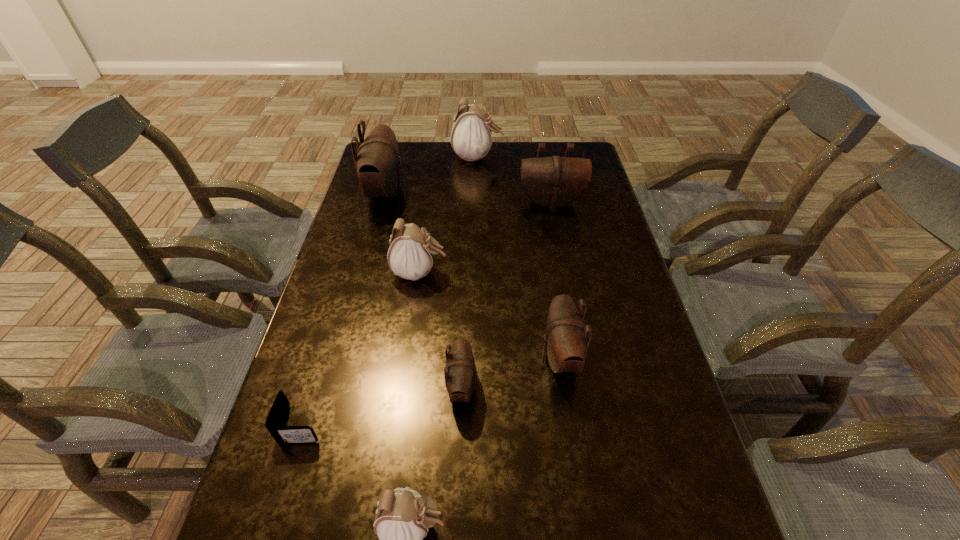
Where is `the biggest brown pouch`? This screenshot has height=540, width=960. the biggest brown pouch is located at coordinates (377, 161).

Identify the location of the leftmost pouch. The height and width of the screenshot is (540, 960). (377, 161).

Where is `the farthest white pouch`? the farthest white pouch is located at coordinates (471, 137).

This screenshot has width=960, height=540. Identify the location of the biggest white pouch. (471, 137).

Find the location of a particular element. the third smallest brown pouch is located at coordinates (552, 182).

Image resolution: width=960 pixels, height=540 pixels. Identify the location of the second smallest white pouch. (410, 256).

This screenshot has height=540, width=960. I want to click on the fourth farthest pouch, so click(410, 256).

Where is `the third biggest brown pouch`? The width and height of the screenshot is (960, 540). the third biggest brown pouch is located at coordinates (566, 341).

Find the location of a particular element. The width and height of the screenshot is (960, 540). the second brown pouch from left to right is located at coordinates (460, 373).

Find the location of a particular element. The image size is (960, 540). wallet is located at coordinates (282, 434).